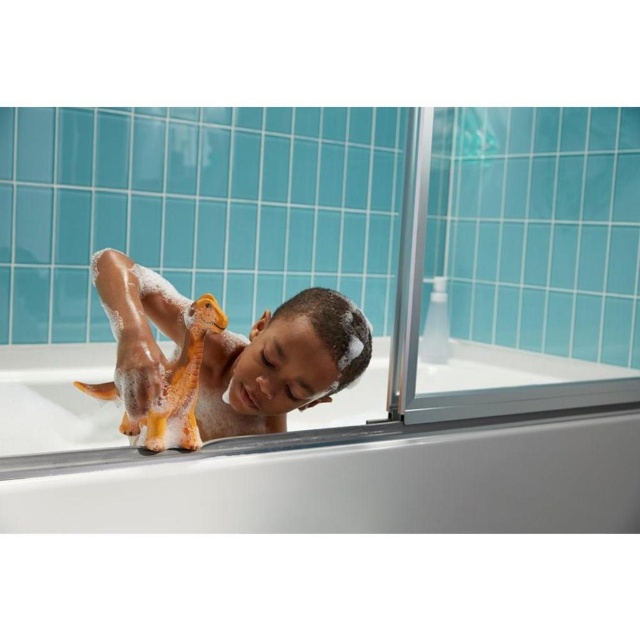
You need to place a new bath toy in the bathroom. The toy is the same size as the orange rubber duck at center. Where can you put it so it fits comfortably without overcrowding the white glossy bathtub at center?

Since the white glossy bathtub at center is bigger than the orange rubber duck at center, you can place the new bath toy next to the orange rubber duck at center in the white glossy bathtub at center. There should be enough space as the bathtub is larger than the existing toy.

You are a drone operator trying to capture a closeup of the orange dinosaur toy in the bathtub. The drone is currently at a point 36.35 inches away from the camera. Can you safely land the drone on the point marked at coordinate point (x=97, y=506) without crashing into the bathtub or other objects?

The distance between the point marked at coordinate point (x=97, y=506) and the camera is 36.35 inches. Since the drone is at that exact distance, it can safely land on the point marked at coordinate point (x=97, y=506) as long as there are no obstructions in its path.

You are a parent trying to locate two points in the bathroom. The first point is at coordinate point (x=216, y=499) and the second is at point (x=266, y=388). From your perspective standing in the bathroom, which point is closer to you?

Point (x=216, y=499) is in front of point (x=266, y=388), so it is closer to you.